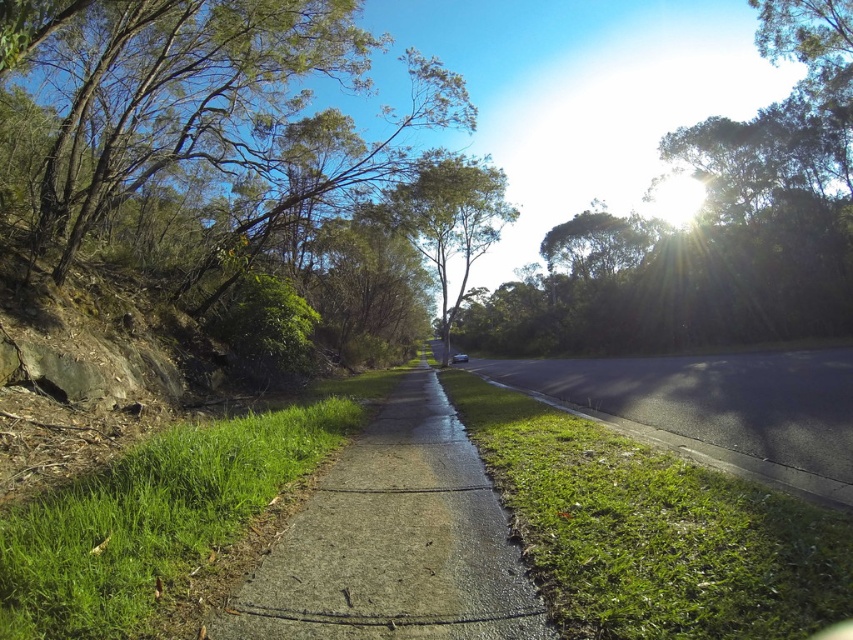
Between green leafy tree at left and green leafy tree at upper center, which one appears on the left side from the viewer's perspective?

From the viewer's perspective, green leafy tree at left appears more on the left side.

Where is `green leafy tree at left`? The image size is (853, 640). green leafy tree at left is located at coordinates (202, 120).

Find the location of `green leafy tree at left`. green leafy tree at left is located at coordinates (202, 120).

Which is behind, point (271, 612) or point (468, 237)?

Positioned behind is point (468, 237).

Does point (350, 616) come farther from viewer compared to point (491, 204)?

That is False.

Does point (368, 520) lie behind point (444, 161)?

No, it is not.

Image resolution: width=853 pixels, height=640 pixels. In order to click on concrete at center in this screenshot , I will do `click(393, 541)`.

Can you confirm if green leafy tree at left is positioned to the left of green leafy tree at center?

Yes, green leafy tree at left is to the left of green leafy tree at center.

How far apart are green leafy tree at left and green leafy tree at center?

They are 309.98 feet apart.

Identify the location of green leafy tree at left. The width and height of the screenshot is (853, 640). (202, 120).